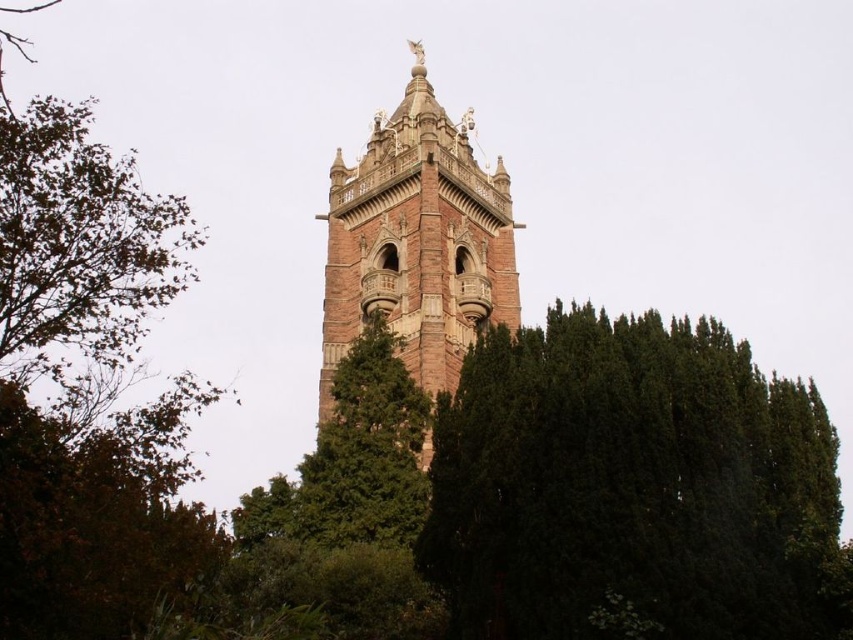
You are standing at the base of the tower and want to take a photo of the point at coordinates point (x=480, y=390). If your camera has a maximum zoom range of 50 meters, will you be able to capture the point clearly?

The point (x=480, y=390) is 57.05 meters away from the camera. Since the camera can only zoom up to 50 meters, it won not be able to capture the point clearly.

You are an architect evaluating the space around the green leafy tree at center and the brown stone tower at center. Which object takes up more area in the image?

The brown stone tower at center occupies more space than the green leafy tree at center, so the brown stone tower at center takes up more area in the image.

You are standing in a garden and want to take a photo of the brown stone tower at center without any obstructions. Which direction should you move to ensure the green leafy tree at center is not blocking the view?

You should move to the left side of the brown stone tower at center because the green leafy tree at center is positioned to its right, so moving left would place the tree out of the frame.